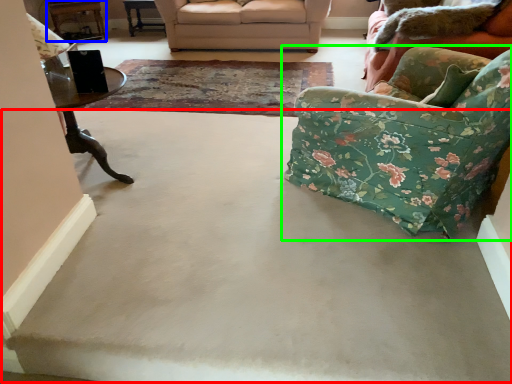
Question: Considering the real-world distances, which object is closest to concrete (highlighted by a red box)? table (highlighted by a blue box) or chair (highlighted by a green box).

Choices:
 (A) table
 (B) chair

Answer: (B)